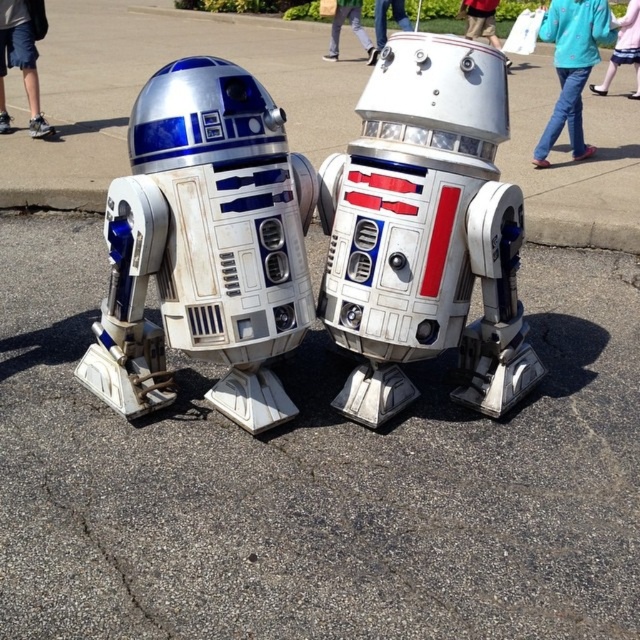
Who is higher up, blue fabric pants at upper center or blue fabric pants at center?

blue fabric pants at center is higher up.

Is blue fabric pants at upper center closer to camera compared to blue fabric pants at center?

No, it is not.

Which is in front, point (337, 19) or point (474, 10)?

Point (474, 10)

Where is `blue fabric pants at upper center`? blue fabric pants at upper center is located at coordinates (352, 28).

Between white matte robot at center and blue fabric pants at center, which one has less height?

blue fabric pants at center

The height and width of the screenshot is (640, 640). Describe the element at coordinates (426, 230) in the screenshot. I see `white matte robot at center` at that location.

Where is `white matte robot at center`? white matte robot at center is located at coordinates (426, 230).

You are a GUI agent. You are given a task and a screenshot of the screen. Output one action in this format:
    pyautogui.click(x=<x>, y=<y>)
    Task: Click on the blue fabric pants at center
    Image resolution: width=640 pixels, height=640 pixels.
    Given the screenshot: What is the action you would take?
    pyautogui.click(x=481, y=19)

Between blue fabric pants at center and white plastic head at center, which one appears on the right side from the viewer's perspective?

From the viewer's perspective, blue fabric pants at center appears more on the right side.

Find the location of a particular element. The image size is (640, 640). blue fabric pants at center is located at coordinates (481, 19).